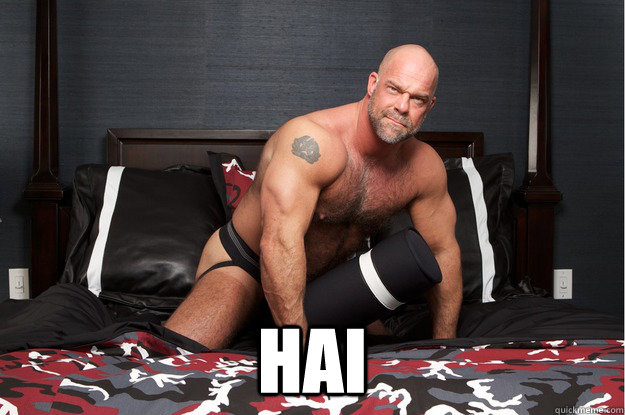
Identify the location of pillows. (145, 247).